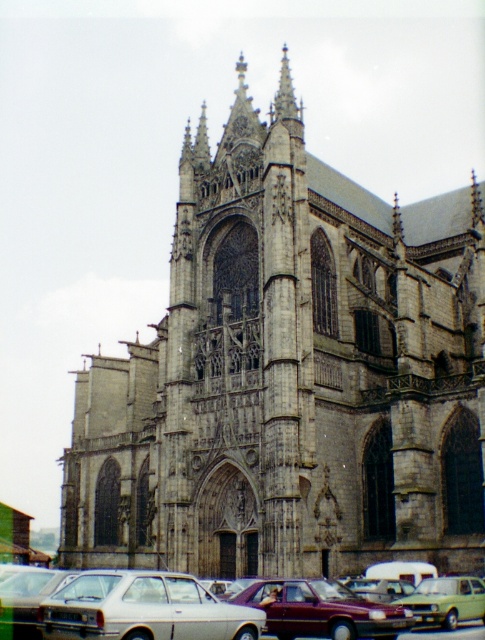
You are a visitor approaching the cathedral and want to park your car in the parking lot. You see the white matte car at lower left and the white glossy sedan at lower center. Which car is blocking the path to the parking spot closest to the cathedral?

The white matte car at lower left is positioned over the white glossy sedan at lower center, meaning it is blocking the path to the parking spot closest to the cathedral.